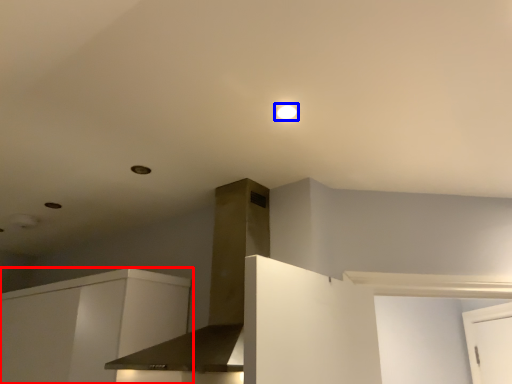
Question: Among these objects, which one is nearest to the camera, cabinetry (highlighted by a red box) or lighting (highlighted by a blue box)?

Choices:
 (A) cabinetry
 (B) lighting

Answer: (B)